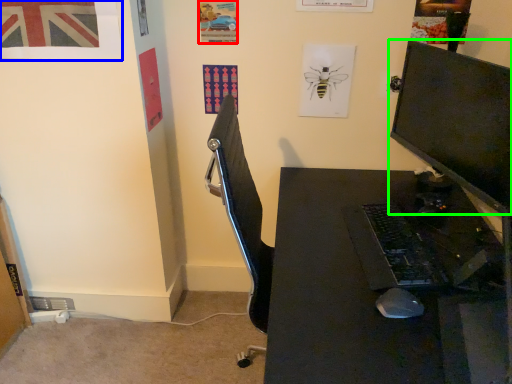
Question: Estimate the real-world distances between objects in this image. Which object is closer to poster page (highlighted by a red box), poster page (highlighted by a blue box) or computer monitor (highlighted by a green box)?

Choices:
 (A) poster page
 (B) computer monitor

Answer: (A)